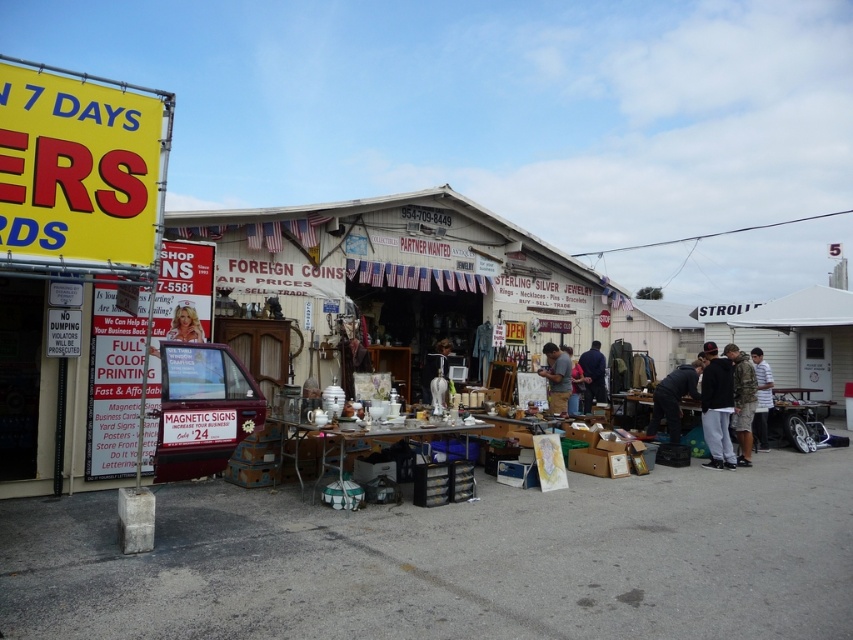
You are a customer at the flea market and want to buy a jacket. You see the dark gray fabric jacket at lower right and the white striped shirt at center. Which item is positioned higher up?

The dark gray fabric jacket at lower right is above the white striped shirt at center, so the jacket is positioned higher up.